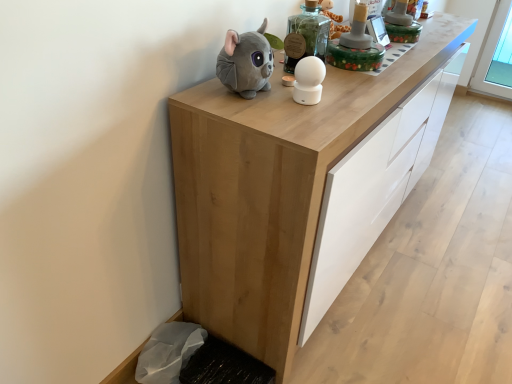
You are a GUI agent. You are given a task and a screenshot of the screen. Output one action in this format:
    pyautogui.click(x=<x>, y=<y>)
    Task: Click on the free point behind white matte ball at center, which is the 2th toy in left-to-right order
    This screenshot has width=512, height=384.
    Given the screenshot: What is the action you would take?
    pyautogui.click(x=332, y=79)